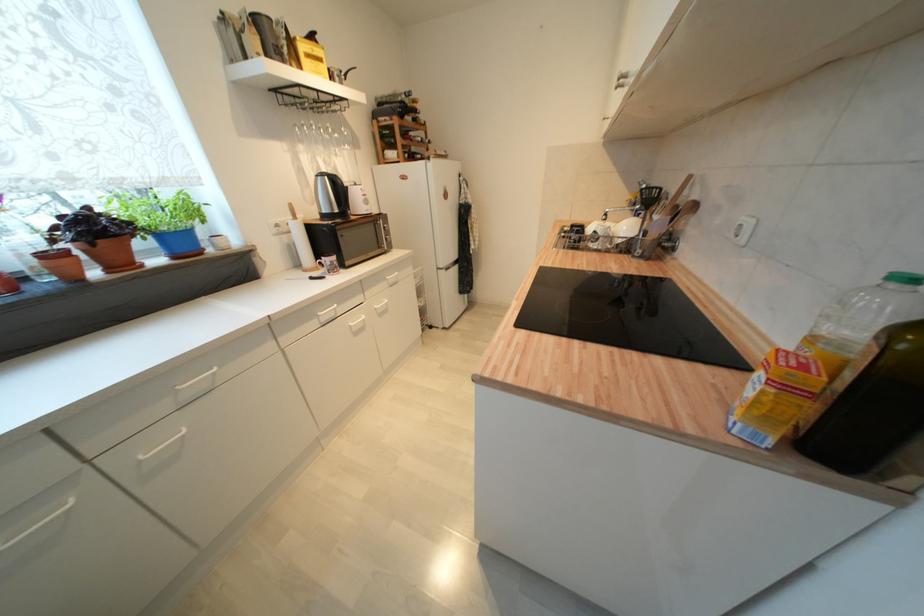
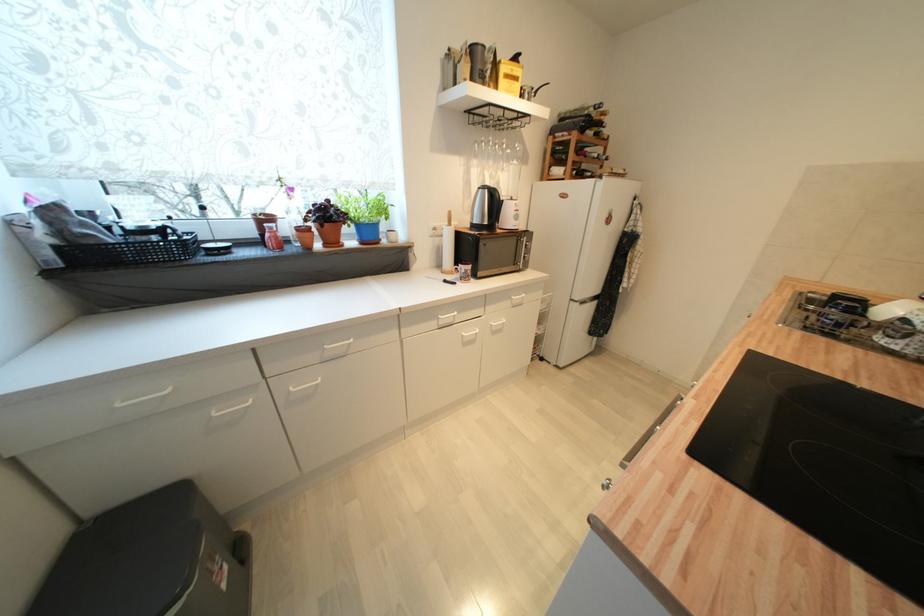
Find the pixel in the second image that matches (x=49, y=249) in the first image.

(306, 225)